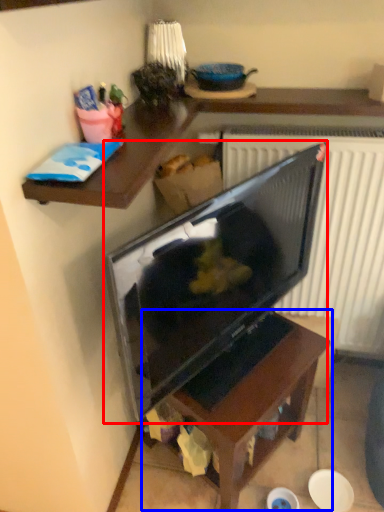
Question: Which object is closer to the camera taking this photo, television (highlighted by a red box) or table (highlighted by a blue box)?

Choices:
 (A) television
 (B) table

Answer: (A)